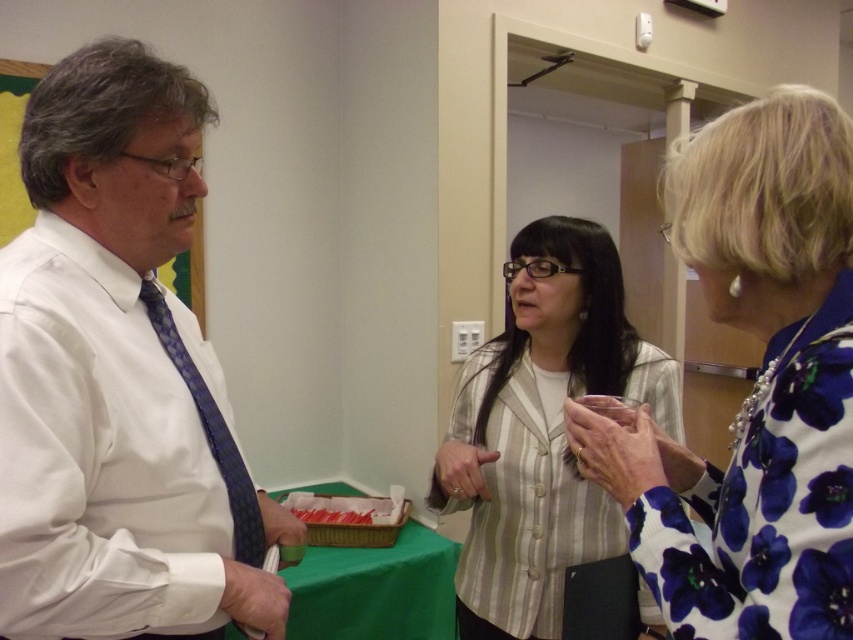
Question: Which point is farther to the camera?

Choices:
 (A) white smooth shirt at left
 (B) striped fabric blazer at center
 (C) green fabric table at center

Answer: (C)

Question: Which is farther from the green fabric table at center?

Choices:
 (A) blue patterned tie at left
 (B) floral-patterned blouse at right

Answer: (B)

Question: Based on their relative distances, which object is nearer to the blue patterned tie at left?

Choices:
 (A) white smooth shirt at left
 (B) striped fabric blazer at center

Answer: (A)

Question: Is the position of striped fabric blazer at center more distant than that of green fabric table at center?

Choices:
 (A) no
 (B) yes

Answer: (A)

Question: Is white smooth shirt at left smaller than floral-patterned blouse at right?

Choices:
 (A) no
 (B) yes

Answer: (A)

Question: Considering the relative positions of white smooth shirt at left and green fabric table at center in the image provided, where is white smooth shirt at left located with respect to green fabric table at center?

Choices:
 (A) left
 (B) right

Answer: (A)